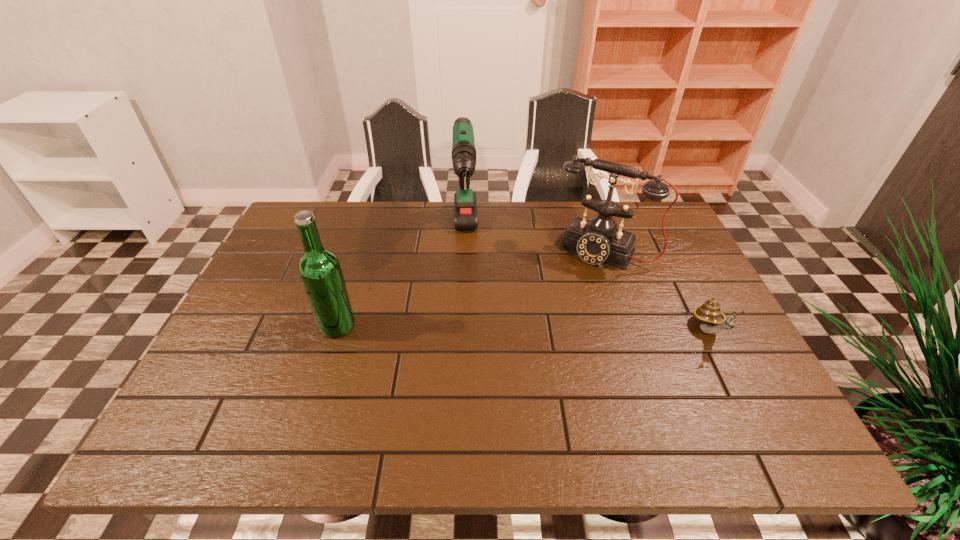
This screenshot has width=960, height=540. Identify the location of the leftmost object. (320, 271).

Locate an element on the screen. The image size is (960, 540). the rightmost object is located at coordinates (712, 320).

Locate an element on the screen. Image resolution: width=960 pixels, height=540 pixels. snail is located at coordinates (712, 320).

Locate an element on the screen. the third object from left to right is located at coordinates (596, 241).

Locate an element on the screen. drill is located at coordinates (464, 155).

Where is `vacant position located on the left of the beer bottle`? The height and width of the screenshot is (540, 960). vacant position located on the left of the beer bottle is located at coordinates (265, 326).

Locate an element on the screen. free space located on the dial of the second object from right to left is located at coordinates (547, 330).

Find the location of a particular element. This screenshot has height=540, width=960. vacant space situated 0.380m on the dial of the second object from right to left is located at coordinates (526, 366).

Image resolution: width=960 pixels, height=540 pixels. Identify the location of vacant space located on the dial of the second object from right to left. (574, 285).

Image resolution: width=960 pixels, height=540 pixels. Identify the location of free space located 0.320m on the handle side of the drill. (467, 374).